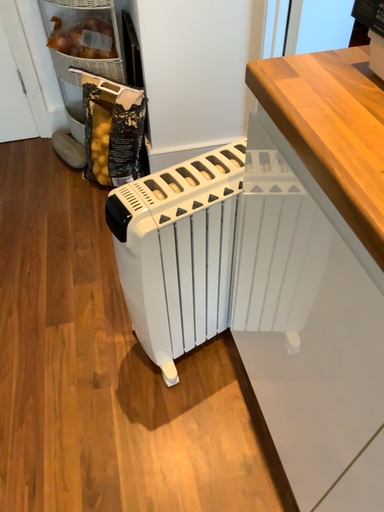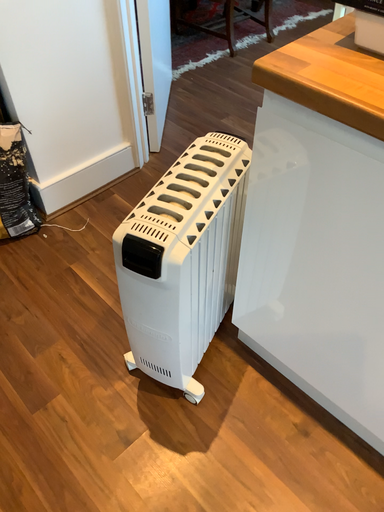
Question: How did the camera likely rotate when shooting the video?

Choices:
 (A) rotated left
 (B) rotated right

Answer: (B)